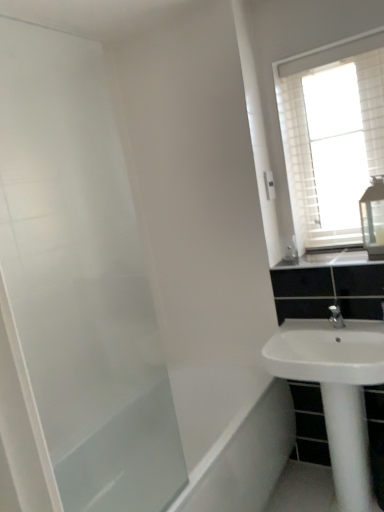
Question: Can you confirm if white glossy sink at lower right is shorter than white glossy sink at upper right?

Choices:
 (A) yes
 (B) no

Answer: (B)

Question: Does white glossy sink at lower right turn towards white glossy sink at upper right?

Choices:
 (A) yes
 (B) no

Answer: (B)

Question: Would you say white glossy sink at upper right is part of white glossy sink at lower right's contents?

Choices:
 (A) no
 (B) yes

Answer: (A)

Question: Is white glossy sink at lower right to the right of white glossy sink at upper right from the viewer's perspective?

Choices:
 (A) yes
 (B) no

Answer: (B)

Question: From a real-world perspective, is white glossy sink at lower right under white glossy sink at upper right?

Choices:
 (A) no
 (B) yes

Answer: (B)

Question: Would you say white glossy sink at lower right is a long distance from white glossy sink at upper right?

Choices:
 (A) yes
 (B) no

Answer: (B)

Question: Can you confirm if clear glass medicine cabinet at upper right is taller than transparent glass screen door at left?

Choices:
 (A) yes
 (B) no

Answer: (B)

Question: Is clear glass medicine cabinet at upper right at the left side of transparent glass screen door at left?

Choices:
 (A) no
 (B) yes

Answer: (A)

Question: Is clear glass medicine cabinet at upper right smaller than transparent glass screen door at left?

Choices:
 (A) no
 (B) yes

Answer: (B)

Question: Is clear glass medicine cabinet at upper right shorter than transparent glass screen door at left?

Choices:
 (A) no
 (B) yes

Answer: (B)

Question: Does clear glass medicine cabinet at upper right have a greater width compared to transparent glass screen door at left?

Choices:
 (A) yes
 (B) no

Answer: (A)

Question: Is the depth of clear glass medicine cabinet at upper right greater than that of transparent glass screen door at left?

Choices:
 (A) no
 (B) yes

Answer: (B)

Question: From the image's perspective, is white glossy sink at lower right below white textured window at upper right?

Choices:
 (A) yes
 (B) no

Answer: (A)